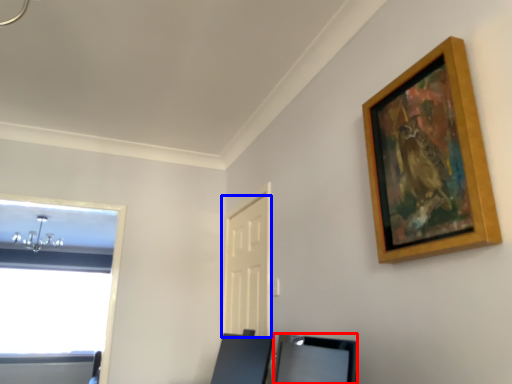
Question: Which object is further to the camera taking this photo, vanity (highlighted by a red box) or door (highlighted by a blue box)?

Choices:
 (A) vanity
 (B) door

Answer: (B)